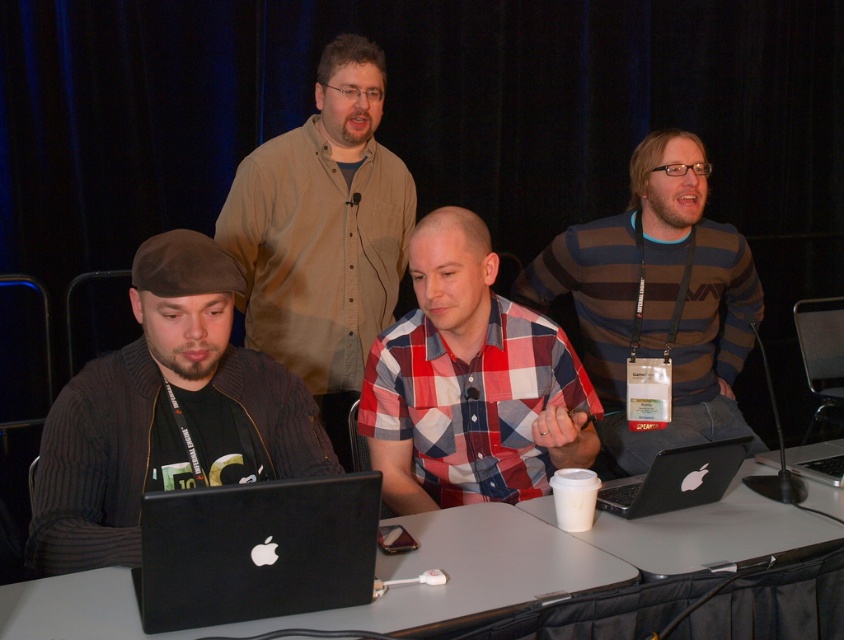
Question: Among these objects, which one is nearest to the camera?

Choices:
 (A) black matte laptop at lower left
 (B) plaid cotton shirt at center
 (C) white plastic table at center

Answer: (A)

Question: Among these objects, which one is nearest to the camera?

Choices:
 (A) silver metallic laptop at center
 (B) matte brown shirt at center
 (C) dark gray knit sweater at left
 (D) black matte laptop at lower left

Answer: (D)

Question: Based on their relative distances, which object is farther from the white plastic table at center?

Choices:
 (A) black matte laptop at lower left
 (B) black plastic table at center
 (C) black plastic laptop at right
 (D) silver metallic laptop at center

Answer: (A)

Question: Is plaid cotton shirt at center to the left of white plastic table at center from the viewer's perspective?

Choices:
 (A) no
 (B) yes

Answer: (B)

Question: Is the position of dark gray knit sweater at left less distant than that of black matte laptop at lower left?

Choices:
 (A) no
 (B) yes

Answer: (A)

Question: Considering the relative positions of striped sweater at center and black plastic laptop at right in the image provided, where is striped sweater at center located with respect to black plastic laptop at right?

Choices:
 (A) below
 (B) above

Answer: (B)